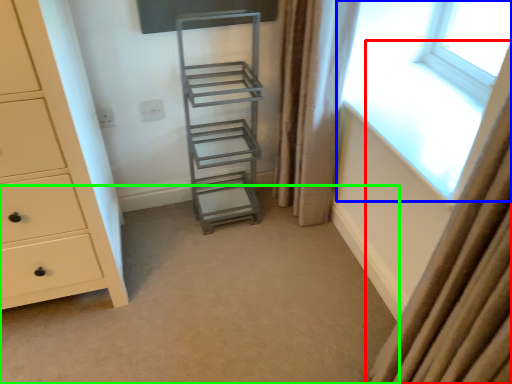
Question: Estimate the real-world distances between objects in this image. Which object is closer to curtain (highlighted by a red box), window (highlighted by a blue box) or plain (highlighted by a green box)?

Choices:
 (A) window
 (B) plain

Answer: (B)